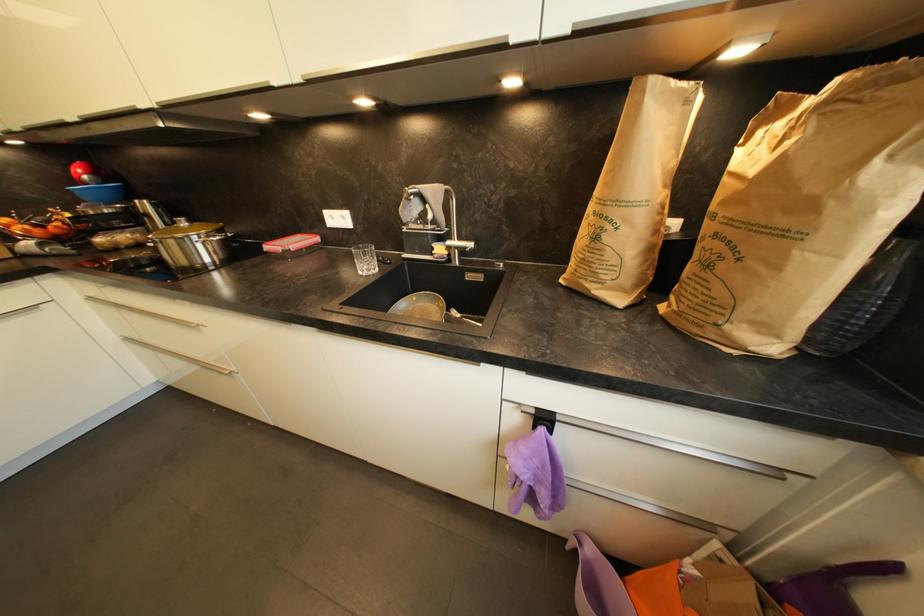
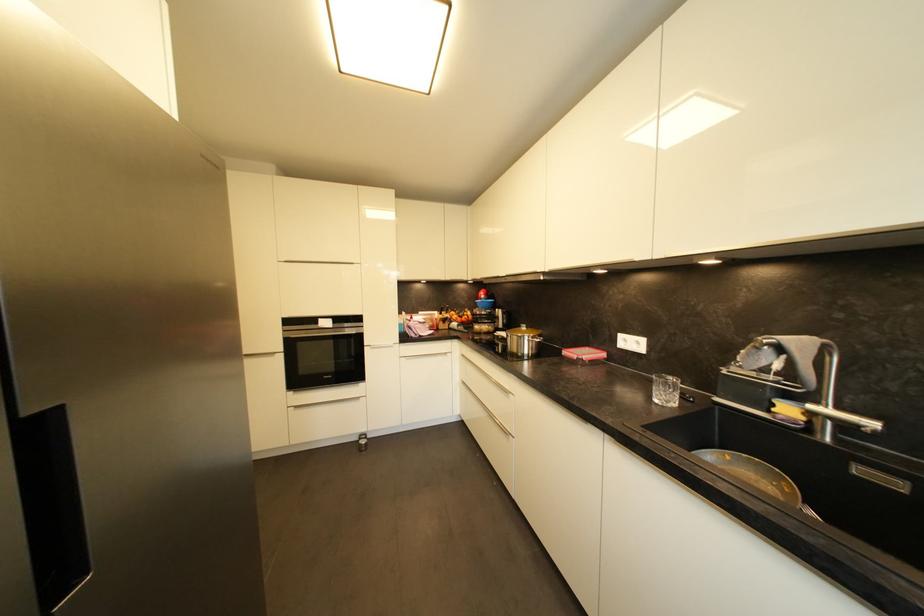
The point at (485, 280) is marked in the first image. Where is the corresponding point in the second image?

(904, 487)